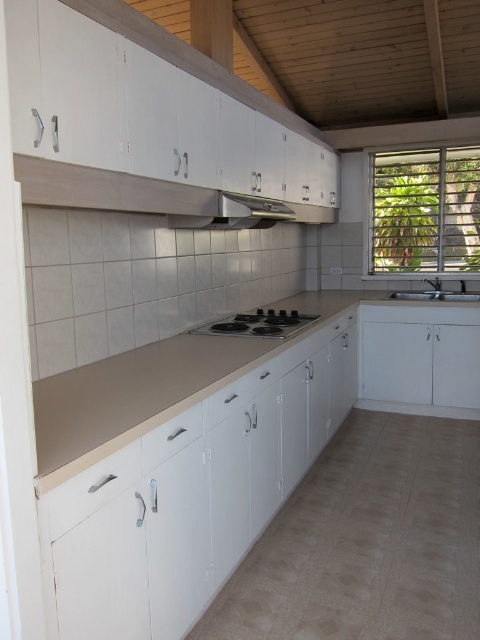
Does point (35, 422) come farther from viewer compared to point (213, 220)?

No, (35, 422) is in front of (213, 220).

In order to click on beige laminate counter top at center in this screenshot , I will do `click(155, 385)`.

Measure the distance between beige laminate counter top at center and camera.

beige laminate counter top at center and camera are 1.21 meters apart.

This screenshot has width=480, height=640. Identify the location of beige laminate counter top at center. (155, 385).

Does matte black exhaust hood at upper center lie in front of satin nickel sink at right?

That is True.

The height and width of the screenshot is (640, 480). Describe the element at coordinates (237, 212) in the screenshot. I see `matte black exhaust hood at upper center` at that location.

Identify the location of matte black exhaust hood at upper center. The height and width of the screenshot is (640, 480). (237, 212).

Between beige laminate counter top at center and black glass stove at center, which one appears on the left side from the viewer's perspective?

beige laminate counter top at center

Who is more forward, (167, 380) or (287, 323)?

Point (167, 380) is in front.

Find the location of `beige laminate counter top at center`. beige laminate counter top at center is located at coordinates (155, 385).